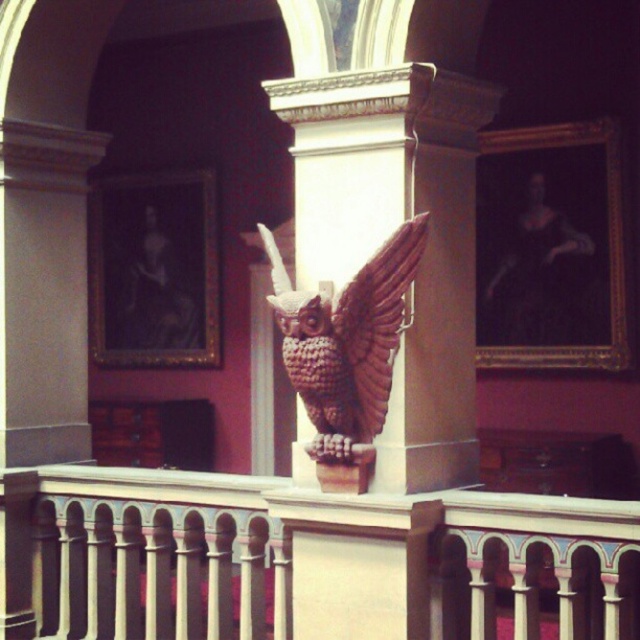
Question: Which object is the closest to the brown carved owl at center?

Choices:
 (A) wooden owl at center
 (B) white painted wood railing at center

Answer: (A)

Question: Which object appears closest to the camera in this image?

Choices:
 (A) white painted wood railing at center
 (B) brown carved owl at center
 (C) wooden owl at center

Answer: (A)

Question: Which of the following is the closest to the observer?

Choices:
 (A) (58, 630)
 (B) (474, 374)
 (C) (321, 416)

Answer: (C)

Question: Can you confirm if brown carved owl at center is smaller than wooden owl at center?

Choices:
 (A) yes
 (B) no

Answer: (B)

Question: Does white painted wood railing at center have a lesser width compared to brown carved owl at center?

Choices:
 (A) yes
 (B) no

Answer: (B)

Question: Does white painted wood railing at center appear on the right side of wooden owl at center?

Choices:
 (A) yes
 (B) no

Answer: (B)